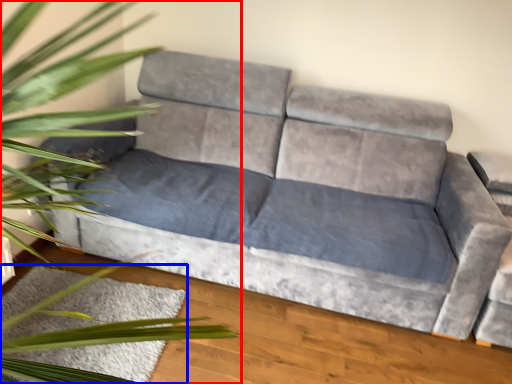
Question: Which object is further to the camera taking this photo, houseplant (highlighted by a red box) or mat (highlighted by a blue box)?

Choices:
 (A) houseplant
 (B) mat

Answer: (B)